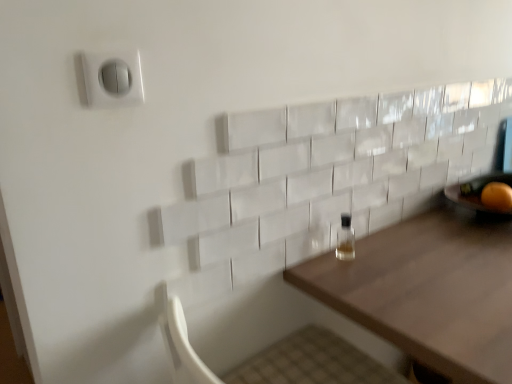
Question: Considering the relative positions of wooden table at center and orange matte at right in the image provided, is wooden table at center to the left of orange matte at right from the viewer's perspective?

Choices:
 (A) yes
 (B) no

Answer: (B)

Question: Is wooden table at center not near orange matte at right?

Choices:
 (A) yes
 (B) no

Answer: (B)

Question: Is wooden table at center further to camera compared to orange matte at right?

Choices:
 (A) no
 (B) yes

Answer: (A)

Question: Is wooden table at center smaller than orange matte at right?

Choices:
 (A) no
 (B) yes

Answer: (A)

Question: Considering the relative sizes of wooden table at center and orange matte at right in the image provided, is wooden table at center thinner than orange matte at right?

Choices:
 (A) no
 (B) yes

Answer: (A)

Question: Considering the positions of wooden table at center and orange matte at right in the image, is wooden table at center wider or thinner than orange matte at right?

Choices:
 (A) wide
 (B) thin

Answer: (A)

Question: Relative to orange matte at right, is wooden table at center in front or behind?

Choices:
 (A) front
 (B) behind

Answer: (A)

Question: Is point (394, 243) positioned closer to the camera than point (505, 200)?

Choices:
 (A) closer
 (B) farther

Answer: (A)

Question: Considering the positions of wooden table at center and orange matte at right in the image, is wooden table at center bigger or smaller than orange matte at right?

Choices:
 (A) big
 (B) small

Answer: (A)

Question: From a real-world perspective, relative to orange matte at right, is clear glass bottle at center vertically above or below?

Choices:
 (A) above
 (B) below

Answer: (B)

Question: In the image, is clear glass bottle at center positioned in front of or behind orange matte at right?

Choices:
 (A) behind
 (B) front

Answer: (B)

Question: Would you say clear glass bottle at center is inside or outside orange matte at right?

Choices:
 (A) inside
 (B) outside

Answer: (B)

Question: Does point (352, 240) appear closer or farther from the camera than point (494, 198)?

Choices:
 (A) closer
 (B) farther

Answer: (A)

Question: Would you say wooden table at center is inside or outside clear glass bottle at center?

Choices:
 (A) inside
 (B) outside

Answer: (B)

Question: Considering the positions of wooden table at center and clear glass bottle at center in the image, is wooden table at center wider or thinner than clear glass bottle at center?

Choices:
 (A) thin
 (B) wide

Answer: (B)